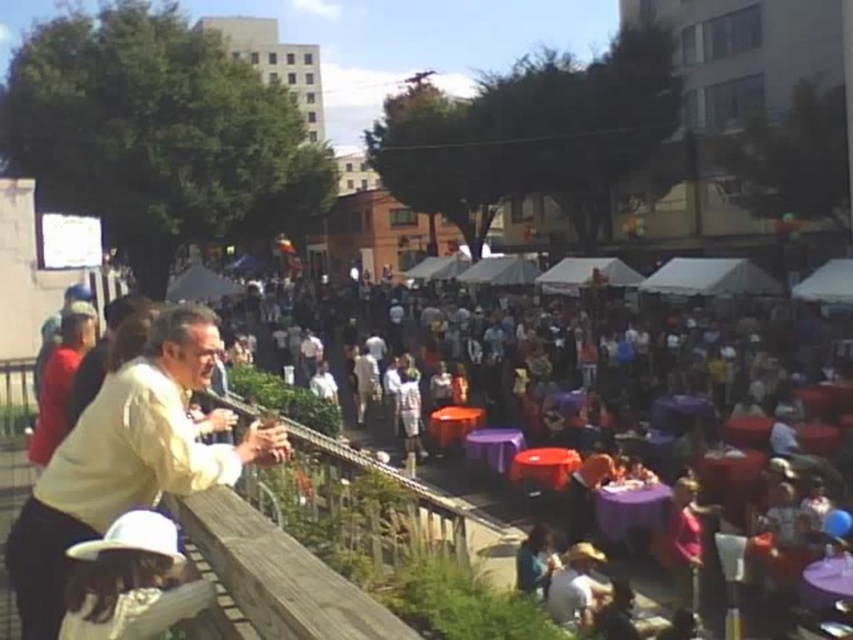
Can you confirm if purple fabric tables at center is shorter than white matte hat at lower left?

Incorrect, purple fabric tables at center's height does not fall short of white matte hat at lower left's.

Does purple fabric tables at center have a larger size compared to white matte hat at lower left?

Yes, purple fabric tables at center is bigger than white matte hat at lower left.

Is point (581, 481) closer to viewer compared to point (131, 624)?

No, (581, 481) is behind (131, 624).

Find the location of `purple fabric tables at center`. purple fabric tables at center is located at coordinates (668, 474).